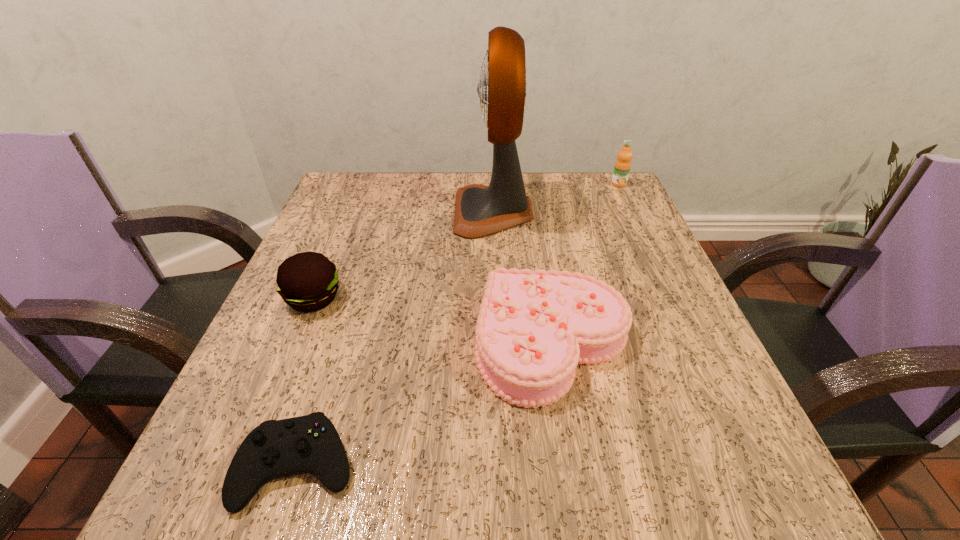
This screenshot has height=540, width=960. In order to click on the second farthest object in this screenshot , I will do `click(480, 210)`.

You are a GUI agent. You are given a task and a screenshot of the screen. Output one action in this format:
    pyautogui.click(x=<x>, y=<y>)
    Task: Click on the tallest object
    
    Given the screenshot: What is the action you would take?
    pyautogui.click(x=480, y=210)

You are a GUI agent. You are given a task and a screenshot of the screen. Output one action in this format:
    pyautogui.click(x=<x>, y=<y>)
    Task: Click on the second tallest object
    The width and height of the screenshot is (960, 540).
    Given the screenshot: What is the action you would take?
    pos(622,167)

At what (x,y) coordinates should I click in order to perform the action: click on orange juice. Please return your answer as a coordinate pair (x, y). The width and height of the screenshot is (960, 540). Looking at the image, I should click on (622, 167).

You are a GUI agent. You are given a task and a screenshot of the screen. Output one action in this format:
    pyautogui.click(x=<x>, y=<y>)
    Task: Click on the third shortest object
    
    Given the screenshot: What is the action you would take?
    pyautogui.click(x=308, y=281)

Image resolution: width=960 pixels, height=540 pixels. Find the location of `the second shortest object`. the second shortest object is located at coordinates (533, 328).

Where is `the nearest object`? the nearest object is located at coordinates (275, 449).

This screenshot has width=960, height=540. I want to click on the shortest object, so click(275, 449).

The width and height of the screenshot is (960, 540). I want to click on blank space located on the front-facing side of the tallest object, so click(x=331, y=212).

Identify the location of free region located on the front-facing side of the tallest object. (396, 212).